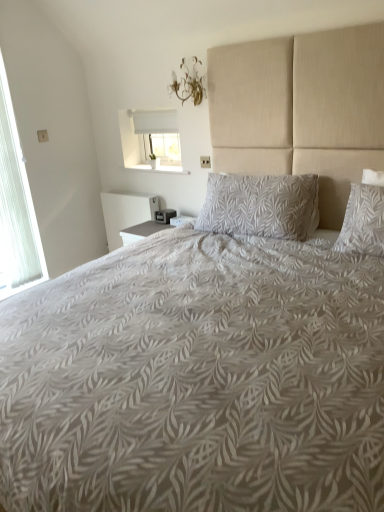
Question: Does point (248, 184) appear closer or farther from the camera than point (11, 167)?

Choices:
 (A) closer
 (B) farther

Answer: (A)

Question: From their relative heights in the image, would you say gray leaf-patterned pillow at center is taller or shorter than white sheer curtain at left, which appears as the first window when viewed from the left?

Choices:
 (A) short
 (B) tall

Answer: (A)

Question: Which object is the closest to the white fabric window at upper center, placed as the 2th window when sorted from left to right?

Choices:
 (A) gray leaf-patterned pillow at center
 (B) gold metallic chandelier at upper center
 (C) white sheer curtain at left, which is the 2th window in right-to-left order

Answer: (B)

Question: Which is nearer to the gray leaf-patterned pillow at center?

Choices:
 (A) gold metallic chandelier at upper center
 (B) white fabric window at upper center, placed as the first window when sorted from right to left
 (C) white sheer curtain at left, which is the 2th window in right-to-left order

Answer: (A)